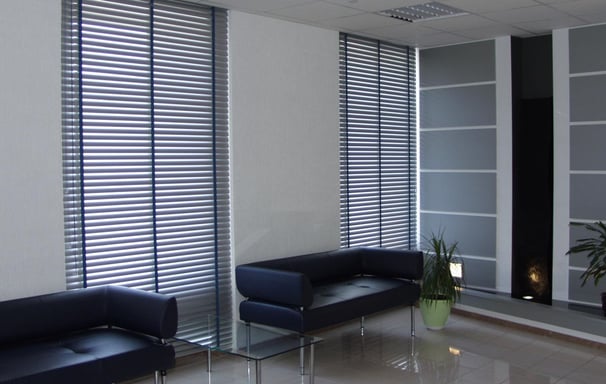
This screenshot has width=606, height=384. In order to click on ceiling tiles in this screenshot , I will do `click(485, 36)`, `click(551, 25)`, `click(521, 12)`, `click(460, 23)`, `click(441, 43)`, `click(407, 33)`, `click(353, 23)`, `click(317, 10)`.